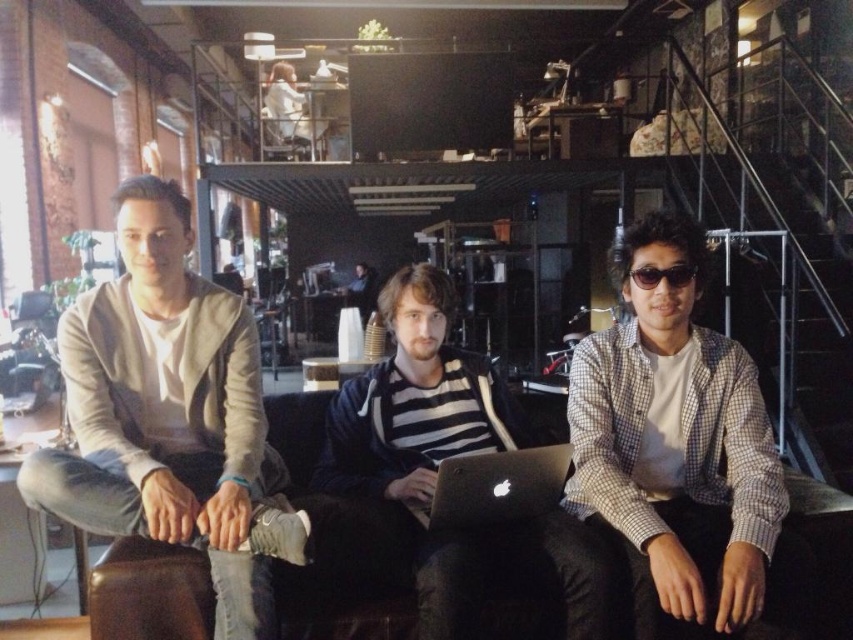
You are standing at point (347,285) and want to walk to point (196,445). Given the layout of the co working space, will you have to walk towards the couch or away from it?

Point (196,445) is in front of point (347,285), so you will have to walk towards the couch to reach it.